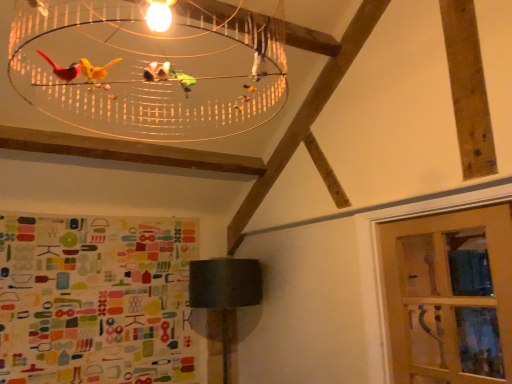
Question: Considering the positions of translucent plastic birdcage at upper center and clear glass door at lower right in the image, is translucent plastic birdcage at upper center wider or thinner than clear glass door at lower right?

Choices:
 (A) thin
 (B) wide

Answer: (B)

Question: From a real-world perspective, is translucent plastic birdcage at upper center positioned above or below clear glass door at lower right?

Choices:
 (A) above
 (B) below

Answer: (A)

Question: Considering the real-world distances, which object is farthest from the matte black lampshade at lower center?

Choices:
 (A) translucent plastic birdcage at upper center
 (B) clear glass door at lower right

Answer: (B)

Question: Which of these objects is positioned closest to the matte black lampshade at lower center?

Choices:
 (A) translucent plastic birdcage at upper center
 (B) clear glass door at lower right

Answer: (A)